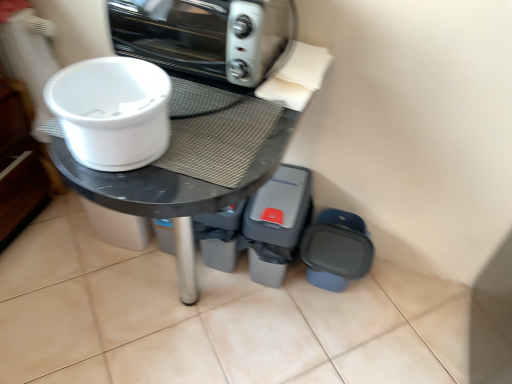
I want to click on vacant space positioned to the left of matte plastic container at lower right, the second appliance viewed from the left, so click(269, 311).